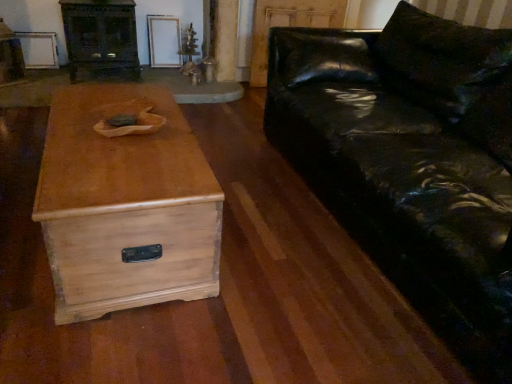
The width and height of the screenshot is (512, 384). What are the coordinates of `blank space above light wood chest at center (from a real-world perspective)` in the screenshot? It's located at (122, 139).